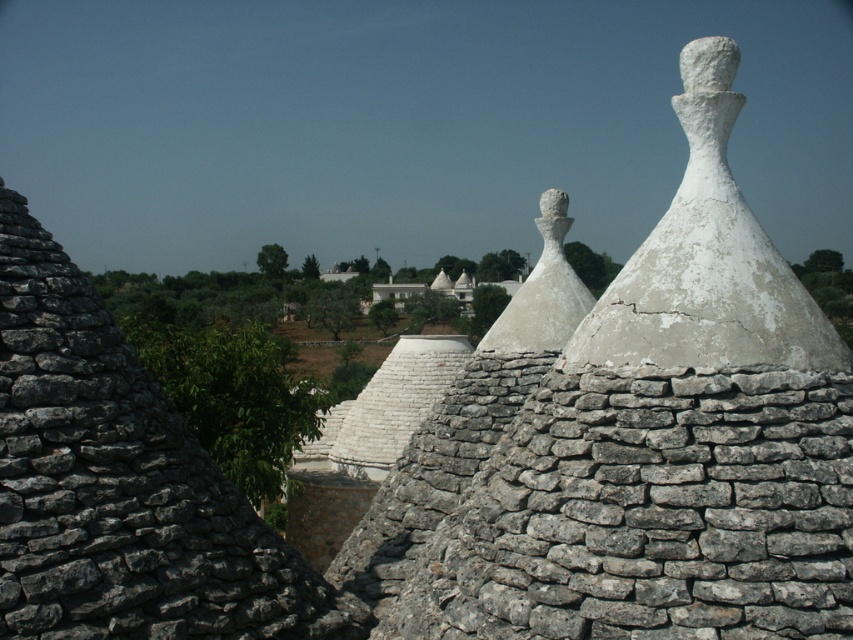
You are standing in front of the three trulli in the foreground. You see the white cracked stone cone at center and the white stone statue at center. Which one is positioned to the right?

The white cracked stone cone at center is to the right of the white stone statue at center.

You are standing in front of the trulli structures and want to determine the relative positions of two points marked in the image. Which point, point [728,323] or point [544,349], is closer to you?

Point [728,323] is closer to the viewer than point [544,349].